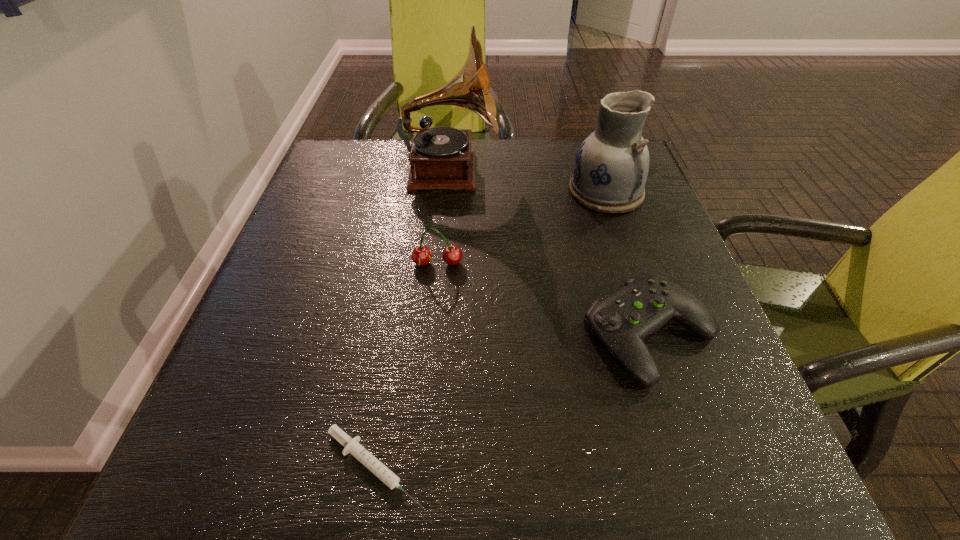
Identify the location of vacant space at the left edge of the desktop. Image resolution: width=960 pixels, height=540 pixels. point(313,280).

Find the location of a particular element. This screenshot has width=960, height=540. free space at the right edge of the desktop is located at coordinates (697, 407).

Identify the location of free region at the far left corner. (336, 142).

You are a GUI agent. You are given a task and a screenshot of the screen. Output one action in this format:
    pyautogui.click(x=<x>, y=<y>)
    Task: Click on the unoccupied position between the second nearest object and the syringe
    Image resolution: width=960 pixels, height=540 pixels.
    Given the screenshot: What is the action you would take?
    pyautogui.click(x=512, y=400)

At what (x,y) coordinates should I click in order to perform the action: click on free spot between the phonograph_record and the cherry. Please return your answer as a coordinate pair (x, y). Image resolution: width=960 pixels, height=540 pixels. Looking at the image, I should click on (444, 218).

Find the location of a particular element. The image size is (960, 540). unoccupied area between the tallest object and the third nearest object is located at coordinates (444, 218).

You are a GUI agent. You are given a task and a screenshot of the screen. Output one action in this format:
    pyautogui.click(x=<x>, y=<y>)
    Task: Click on the vacant area that lies between the fourth tallest object and the syringe
    
    Given the screenshot: What is the action you would take?
    [512, 400]

I want to click on free spot between the phonograph_record and the control, so [550, 253].

Image resolution: width=960 pixels, height=540 pixels. Identify the location of free space between the fourth shortest object and the tallest object. (528, 182).

This screenshot has width=960, height=540. In order to click on empty location between the control and the second tallest object in this screenshot , I will do `click(628, 263)`.